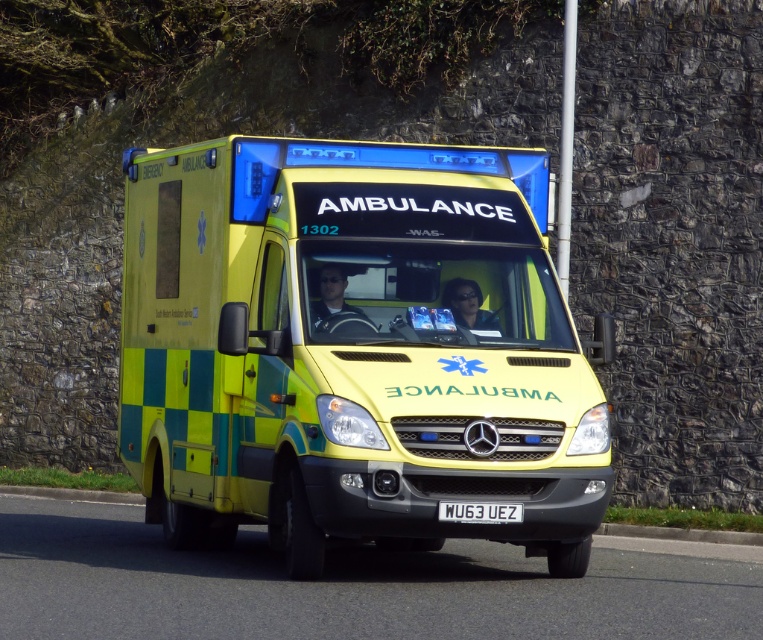
Is matte black helmet at center to the right of white plastic license plate at center from the viewer's perspective?

No, matte black helmet at center is not to the right of white plastic license plate at center.

Can you confirm if matte black helmet at center is bigger than white plastic license plate at center?

Yes, matte black helmet at center is bigger than white plastic license plate at center.

Between point (327, 289) and point (443, 508), which one is positioned in front?

Point (443, 508) is in front.

The image size is (763, 640). In order to click on matte black helmet at center in this screenshot , I will do `click(335, 304)`.

Between matte black helmet at center and matte black sunglasses at center, which one has less height?

With less height is matte black sunglasses at center.

Describe the element at coordinates (335, 304) in the screenshot. I see `matte black helmet at center` at that location.

Find the location of a particular element. Image resolution: width=763 pixels, height=640 pixels. matte black helmet at center is located at coordinates (335, 304).

Can you confirm if yellow/green checkered ambulance at center is positioned above matte black helmet at center?

Incorrect, yellow/green checkered ambulance at center is not positioned above matte black helmet at center.

Between yellow/green checkered ambulance at center and matte black helmet at center, which one has less height?

Standing shorter between the two is matte black helmet at center.

Which is behind, point (425, 336) or point (330, 323)?

Positioned behind is point (330, 323).

Locate an element on the screen. This screenshot has height=640, width=763. yellow/green checkered ambulance at center is located at coordinates (349, 353).